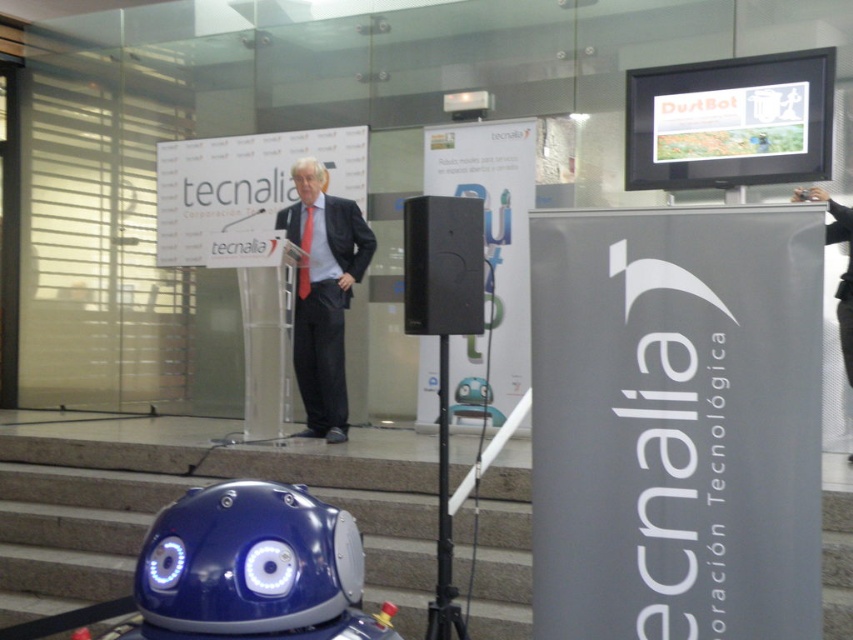
You are a technician standing at the back of the room. You need to adjust the microphone of the black matte speaker at center. Can you reach it from your current position without moving closer?

The black matte speaker at center is 2.70 meters away from the camera, so if you are at the back of the room, you would need to move closer to reach the microphone.

You are an attendee at the event and want to move from the front of the room to the stage. The stage is behind the smooth concrete stairs at lower center and the matte black suit at center. Which object must you pass through first?

The smooth concrete stairs at lower center must be passed through first because they are larger in size compared to the matte black suit at center, so they are more likely to be in the path towards the stage.